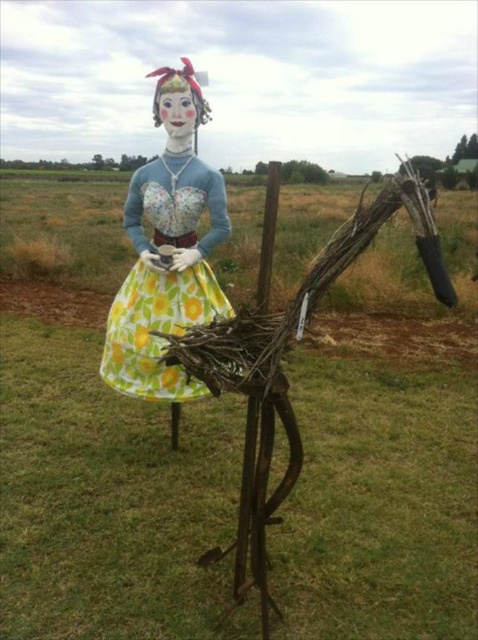
You are an artist planning to paint a mural inspired by this sculpture. You want to ensure the yellow floral dress at center and the floral fabric dress at center are proportionally accurate. Which dress should you make smaller in your painting to maintain the correct scale?

The yellow floral dress at center should be made smaller in the painting since it has a smaller size compared to the floral fabric dress at center according to the description.

You are an artist standing in front of the sculpture and want to paint the yellow floral dress at center and the floral fabric dress at center. Which one is positioned to the right?

The yellow floral dress at center is to the right of the floral fabric dress at center.